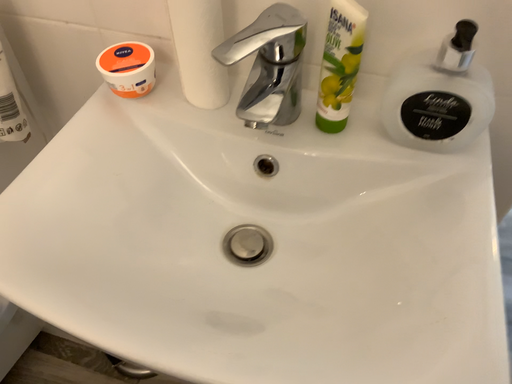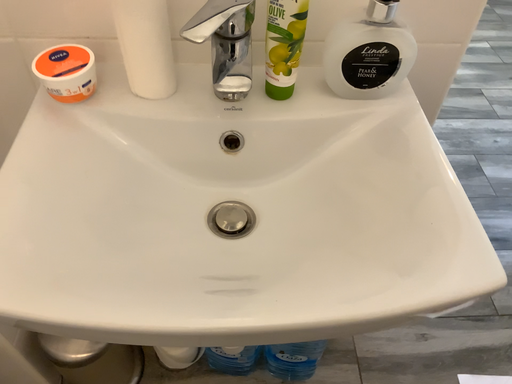
Question: Which way did the camera rotate in the video?

Choices:
 (A) rotated left
 (B) rotated right

Answer: (B)